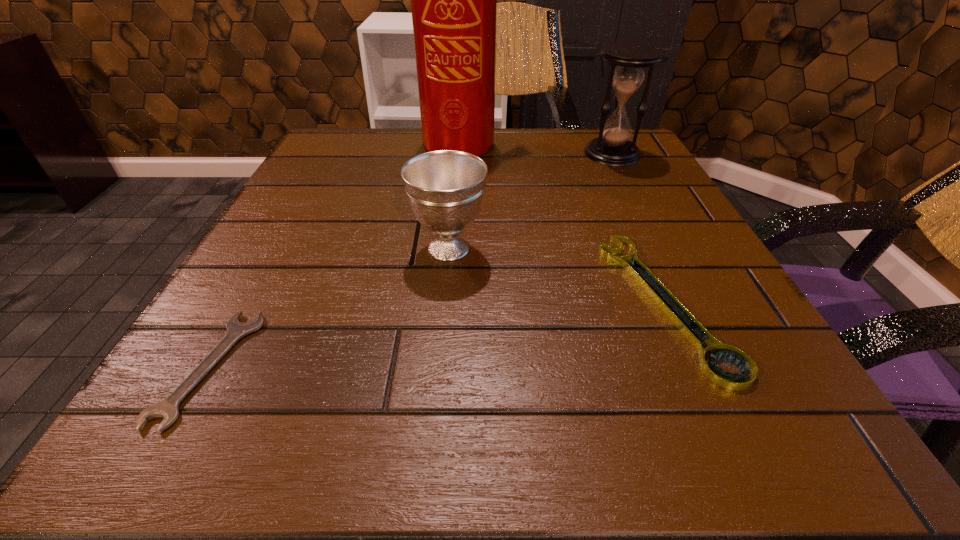
You are a GUI agent. You are given a task and a screenshot of the screen. Output one action in this format:
    pyautogui.click(x=<x>, y=<y>)
    Task: Click on the vacant point at the far edge
    Image resolution: width=960 pixels, height=540 pixels.
    Given the screenshot: What is the action you would take?
    pyautogui.click(x=403, y=159)

In the image, there is a desktop. Identify the location of free space at the near edge. (382, 447).

Where is `free space at the left edge of the desktop`? The height and width of the screenshot is (540, 960). free space at the left edge of the desktop is located at coordinates (350, 258).

Where is `vacant space at the right edge of the desktop`? This screenshot has height=540, width=960. vacant space at the right edge of the desktop is located at coordinates (627, 287).

Where is `free point at the far left corner`? Image resolution: width=960 pixels, height=540 pixels. free point at the far left corner is located at coordinates (309, 171).

At what (x,y) coordinates should I click in order to perform the action: click on free location at the near left corner. Please return your answer as a coordinate pair (x, y). The image size is (960, 540). Looking at the image, I should click on (193, 401).

This screenshot has height=540, width=960. Find the location of `blank space at the far right corner of the desktop`. blank space at the far right corner of the desktop is located at coordinates (588, 134).

I want to click on vacant space at the near right corner, so (788, 408).

I want to click on vacant space that is in between the hourglass and the chalice, so click(x=530, y=201).

Identify the location of vacant space that is in between the hourglass and the third tallest object. This screenshot has width=960, height=540. (530, 201).